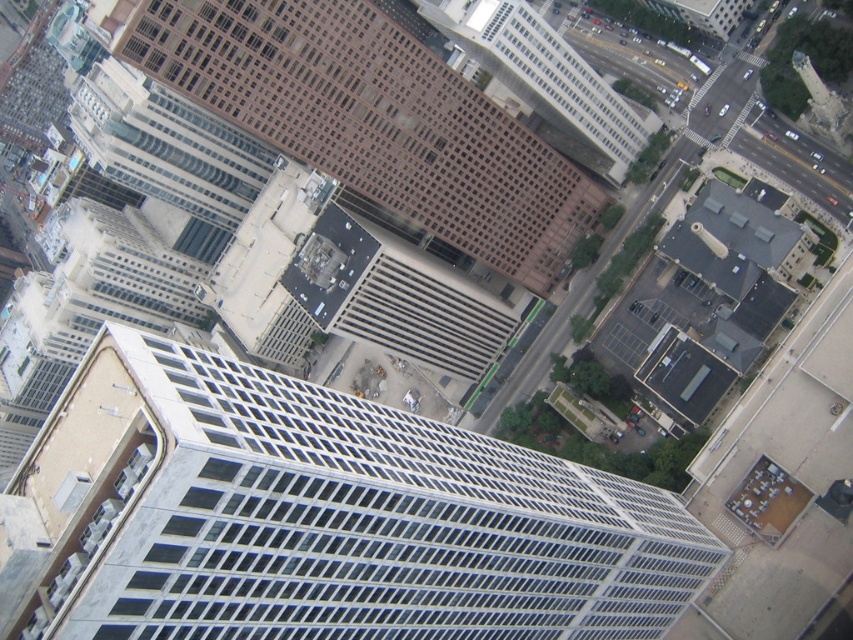
Question: Considering the real-world distances, which object is farthest from the white glass building at center?

Choices:
 (A) brown glass building at center
 (B) brown glassy building at upper center

Answer: (A)

Question: Which object appears closest to the camera in this image?

Choices:
 (A) brown glassy building at upper center
 (B) white glass building at center

Answer: (B)

Question: Is brown glassy building at upper center further to camera compared to brown glass building at center?

Choices:
 (A) yes
 (B) no

Answer: (B)

Question: Which of the following is the closest to the observer?

Choices:
 (A) white glass building at center
 (B) brown glassy building at upper center

Answer: (A)

Question: Can you confirm if white glass building at center is wider than brown glass building at center?

Choices:
 (A) no
 (B) yes

Answer: (B)

Question: Is white glass building at center below brown glass building at center?

Choices:
 (A) no
 (B) yes

Answer: (B)